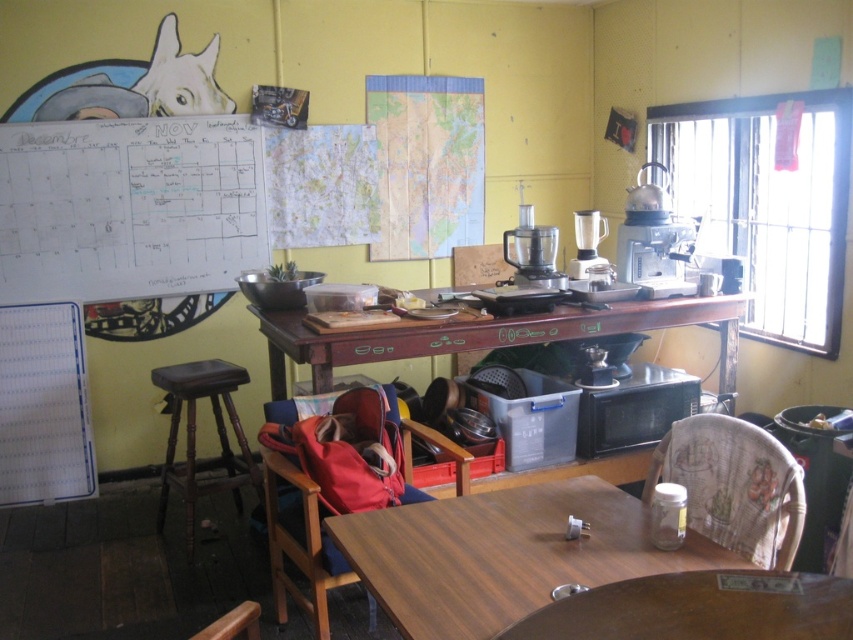
Is whiteboard at left above black matte microwave at center?

Indeed, whiteboard at left is positioned over black matte microwave at center.

Is whiteboard at left smaller than black matte microwave at center?

No.

Which is in front, point (253, 163) or point (584, 444)?

Point (584, 444) is in front.

I want to click on whiteboard at left, so 129,208.

Does wooden table at center appear over black matte microwave at center?

Yes.

Can you confirm if wooden table at center is positioned below black matte microwave at center?

No.

The width and height of the screenshot is (853, 640). Describe the element at coordinates (486, 336) in the screenshot. I see `wooden table at center` at that location.

The image size is (853, 640). Find the location of `wooden table at center`. wooden table at center is located at coordinates (486, 336).

Which of these two, wooden table at center or white fabric chair at lower right, stands taller?

Standing taller between the two is wooden table at center.

Is wooden table at center below white fabric chair at lower right?

Actually, wooden table at center is above white fabric chair at lower right.

This screenshot has height=640, width=853. What do you see at coordinates (486, 336) in the screenshot? I see `wooden table at center` at bounding box center [486, 336].

This screenshot has height=640, width=853. In order to click on wooden table at center in this screenshot , I will do `click(486, 336)`.